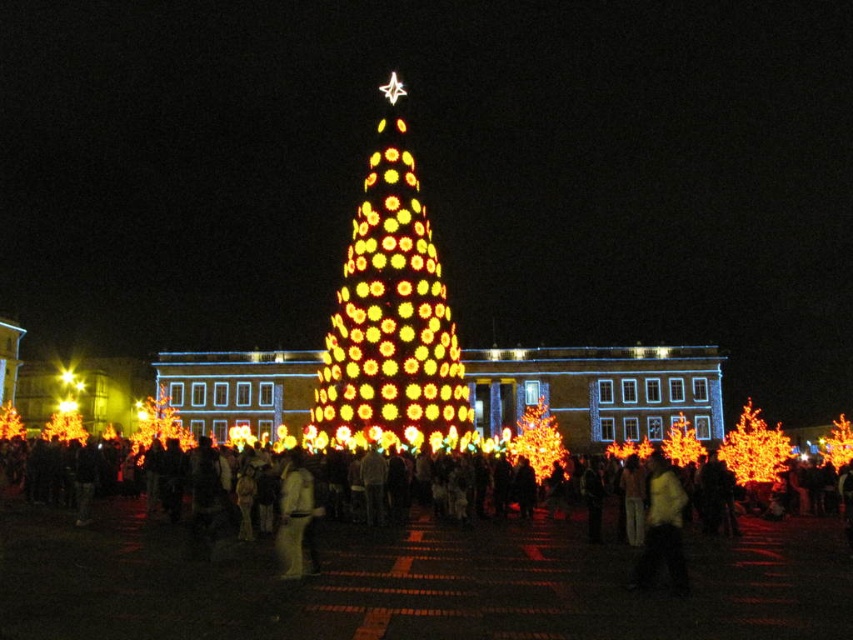
You are planning to place a new decoration on the illuminated plastic christmas tree at center and the illuminated orange lights at right. Based on their sizes, which object would require a smaller decoration to fit properly?

The illuminated plastic christmas tree at center has a lesser width compared to the illuminated orange lights at right, so it would require a smaller decoration to fit properly.